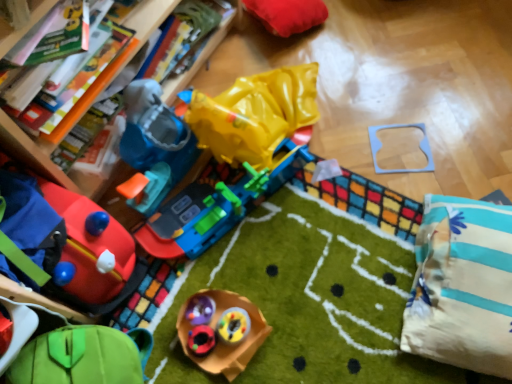
Where is `blank area to the left of rubberized plastic toy at center, which is the third toy from bottom to top`? The width and height of the screenshot is (512, 384). blank area to the left of rubberized plastic toy at center, which is the third toy from bottom to top is located at coordinates (196, 326).